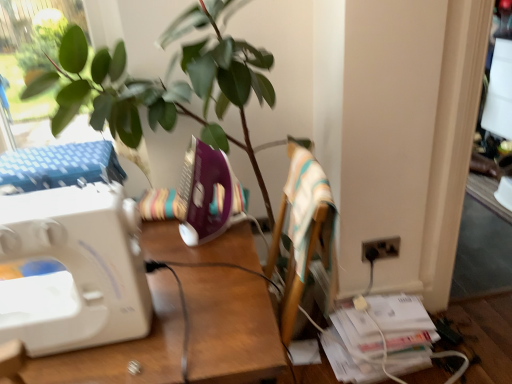
Locate an element on the screen. This screenshot has width=512, height=384. free space to the left of purple plastic sewing machine at center, arranged as the first sewing machine when viewed from the back is located at coordinates (160, 231).